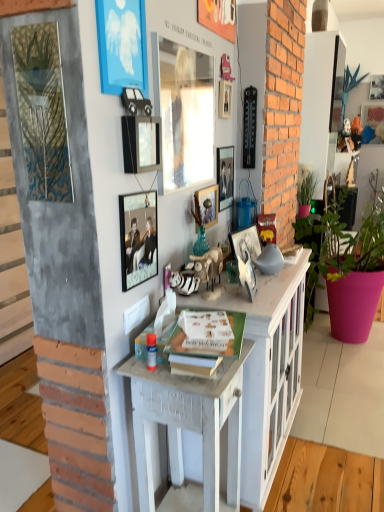
Question: From the image's perspective, is pink matte pot at right, which appears as the second houseplant when viewed from the left, beneath metallic silver photo frame at center, the 7th picture frame positioned from the left?

Choices:
 (A) no
 (B) yes

Answer: (B)

Question: Considering the relative sizes of pink matte pot at right, which appears as the second houseplant when viewed from the left, and metallic silver photo frame at center, positioned as the eighth picture frame in front-to-back order, in the image provided, is pink matte pot at right, which appears as the second houseplant when viewed from the left, shorter than metallic silver photo frame at center, positioned as the eighth picture frame in front-to-back order,?

Choices:
 (A) no
 (B) yes

Answer: (A)

Question: Does pink matte pot at right, placed as the first houseplant when sorted from right to left, have a smaller size compared to metallic silver photo frame at center, the 7th picture frame positioned from the left?

Choices:
 (A) no
 (B) yes

Answer: (A)

Question: Can you confirm if pink matte pot at right, placed as the first houseplant when sorted from right to left, is thinner than metallic silver photo frame at center, the 7th picture frame positioned from the left?

Choices:
 (A) yes
 (B) no

Answer: (B)

Question: Is pink matte pot at right, which appears as the second houseplant when viewed from the left, taller than metallic silver photo frame at center, positioned as the eighth picture frame in front-to-back order?

Choices:
 (A) no
 (B) yes

Answer: (B)

Question: Considering their positions, is metallic silver picture frame at upper center, the seventh picture frame in the right-to-left sequence, located in front of or behind metallic gold picture frame at left, which is counted as the first picture frame, starting from the front?

Choices:
 (A) behind
 (B) front

Answer: (A)

Question: Do you think metallic silver picture frame at upper center, the seventh picture frame in the right-to-left sequence, is within metallic gold picture frame at left, which is counted as the 10th picture frame, starting from the back, or outside of it?

Choices:
 (A) outside
 (B) inside

Answer: (A)

Question: In terms of width, does metallic silver picture frame at upper center, the 4th picture frame positioned from the left, look wider or thinner when compared to metallic gold picture frame at left, the 1th picture frame positioned from the left?

Choices:
 (A) wide
 (B) thin

Answer: (A)

Question: Is point (157, 130) closer or farther from the camera than point (57, 160)?

Choices:
 (A) closer
 (B) farther

Answer: (B)

Question: In the image, is metallic silver picture frame at center, the 3th picture frame when ordered from right to left, on the left side or the right side of matte glass picture frame at center, the 6th picture frame in the left-to-right sequence?

Choices:
 (A) left
 (B) right

Answer: (B)

Question: Considering the positions of metallic silver picture frame at center, which appears as the 5th picture frame when viewed from the back, and matte glass picture frame at center, the fifth picture frame viewed from the right, in the image, is metallic silver picture frame at center, which appears as the 5th picture frame when viewed from the back, taller or shorter than matte glass picture frame at center, the fifth picture frame viewed from the right,?

Choices:
 (A) tall
 (B) short

Answer: (B)

Question: From a real-world perspective, is metallic silver picture frame at center, which is counted as the 6th picture frame, starting from the front, physically located above or below matte glass picture frame at center, acting as the seventh picture frame starting from the front?

Choices:
 (A) above
 (B) below

Answer: (B)

Question: Do you think metallic silver picture frame at center, which appears as the 5th picture frame when viewed from the back, is within matte glass picture frame at center, the 6th picture frame in the left-to-right sequence, or outside of it?

Choices:
 (A) outside
 (B) inside

Answer: (A)

Question: In the image, is matte glass picture frame at center, acting as the seventh picture frame starting from the front, on the left side or the right side of green matte plant at right, arranged as the second houseplant when viewed from the right?

Choices:
 (A) right
 (B) left

Answer: (B)

Question: Looking at the image, does matte glass picture frame at center, the fifth picture frame viewed from the right, seem bigger or smaller compared to green matte plant at right, which ranks as the 1th houseplant in left-to-right order?

Choices:
 (A) small
 (B) big

Answer: (A)